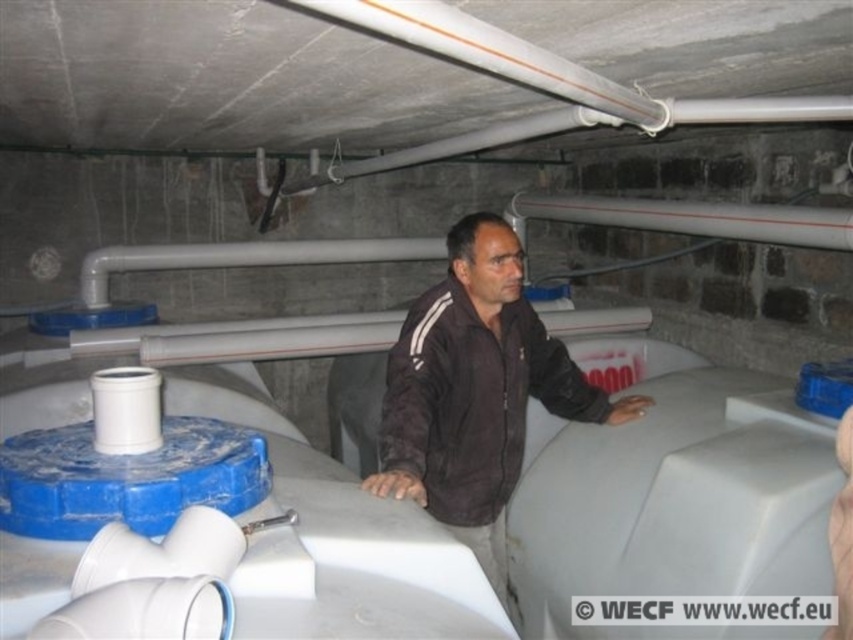
Based on the photo, you are navigating an industrial utility room with concrete walls and large white plastic tanks. You see a dark brown fabric jacket at center. Based on its position, can you determine if it is closer to the foreground tanks or the ceiling pipes?

The dark brown fabric jacket at center is located at point (476, 392), which places it closer to the foreground tanks than the ceiling pipes.

You are a maintenance worker in the utility room and need to locate the white glossy pipe at upper center. Where should you look relative to the dark brown fabric jacket at center?

The dark brown fabric jacket at center is to the left of the white glossy pipe at upper center, so you should look to the right side of the dark brown fabric jacket at center to find the white glossy pipe at upper center.